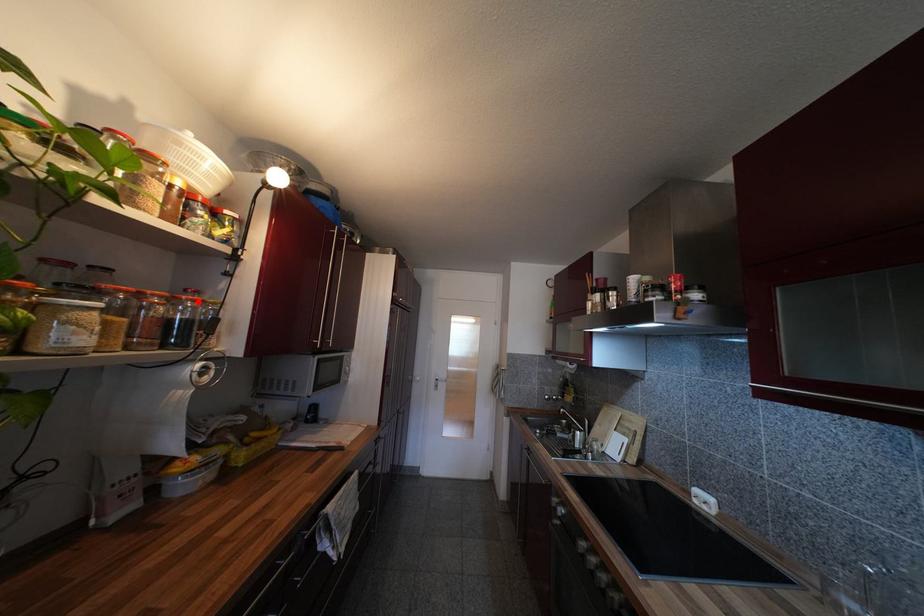
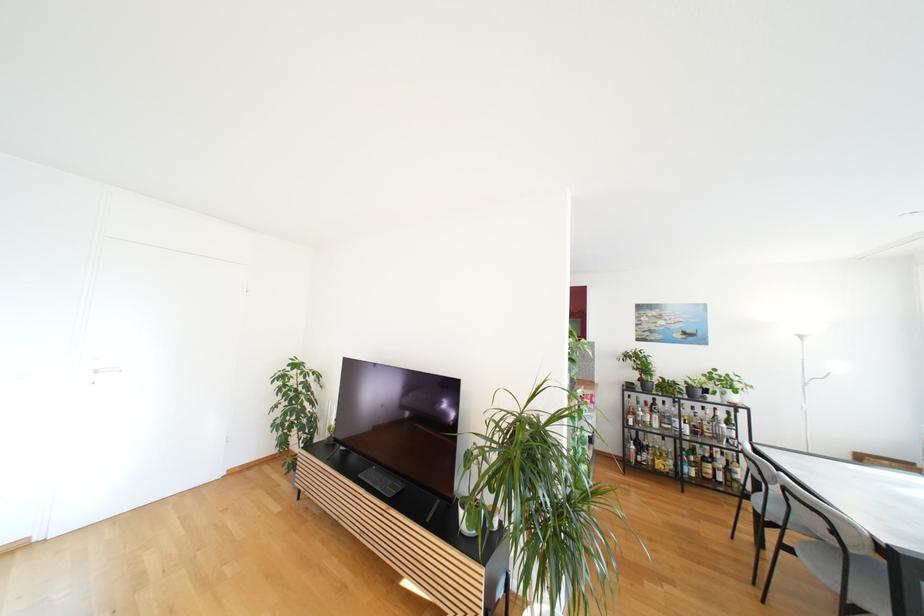
Question: I am providing you with two images of the same scene from different viewpoints. A red point is marked on the first image. At the location where the point appears in image 1, is it still visible in image 2?

Choices:
 (A) Yes
 (B) No

Answer: (B)